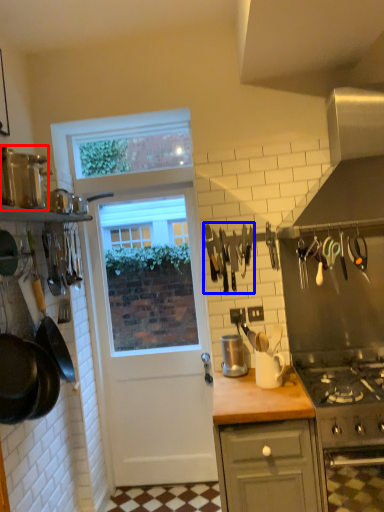
Question: Which point is further to the camera, kitchen appliance (highlighted by a red box) or tool (highlighted by a blue box)?

Choices:
 (A) kitchen appliance
 (B) tool

Answer: (B)